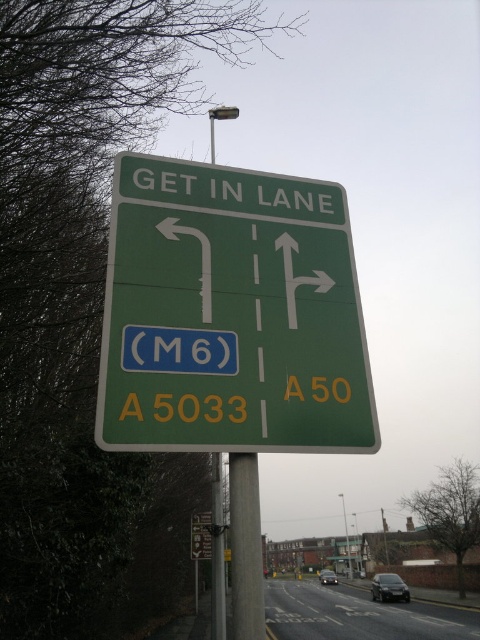
Looking at this image, how far apart are green matte sign at center and metallic pole at center?

green matte sign at center and metallic pole at center are 23.94 feet apart from each other.

This screenshot has height=640, width=480. Describe the element at coordinates (230, 314) in the screenshot. I see `green matte sign at center` at that location.

In the scene shown: Who is more distant from viewer, (x=154, y=273) or (x=216, y=600)?

Positioned behind is point (x=216, y=600).

Locate an element on the screen. green matte sign at center is located at coordinates (230, 314).